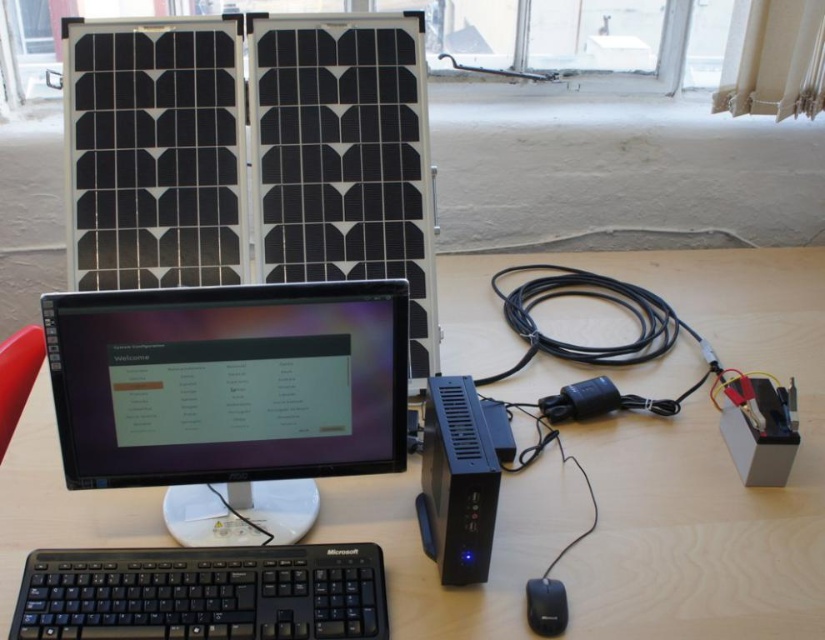
You are setting up a solar computing system and need to place both the wooden at center and the black plastic solar battery at center on the desk. Given their sizes, which object should you place first to ensure they both fit properly?

The wooden at center is larger in size than the black plastic solar battery at center, so you should place the wooden at center first to ensure there is enough space for both objects on the desk.

You are setting up a solar computing system and need to position a new component. The wooden at center and the black glossy monitor at center are in your workspace. Which object is located lower in the setup?

The wooden at center is located below the black glossy monitor at center, so the wooden at center is the lower object in the setup.